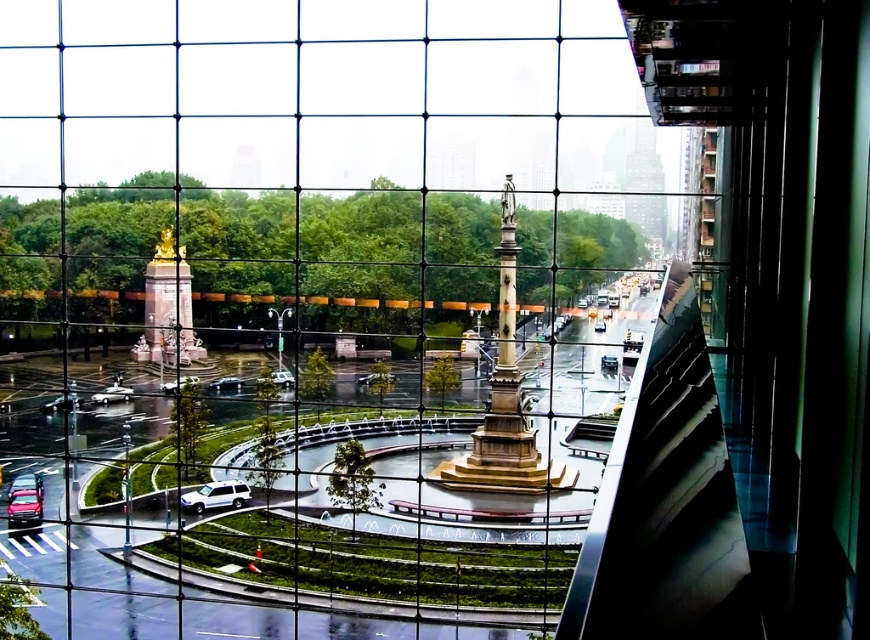
Question: Can you confirm if gold polished statue at center-left is positioned to the left of shiny silver sedan at center?

Choices:
 (A) yes
 (B) no

Answer: (A)

Question: Estimate the real-world distances between objects in this image. Which object is closer to the shiny silver car at lower left?

Choices:
 (A) silver metallic car at center
 (B) shiny silver car at center
 (C) silver metallic sedan at center

Answer: (C)

Question: Is shiny silver car at center wider than metallic silver suv at center?

Choices:
 (A) yes
 (B) no

Answer: (A)

Question: Estimate the real-world distances between objects in this image. Which object is farther from the shiny silver car at lower left?

Choices:
 (A) shiny silver suv at center
 (B) metallic silver suv at center
 (C) shiny silver car at center

Answer: (B)

Question: Which point appears closest to the camera in this image?

Choices:
 (A) (39, 483)
 (B) (199, 500)
 (C) (387, 378)
 (D) (185, 381)

Answer: (B)

Question: Is shiny silver sedan at center to the left of metallic silver suv at center from the viewer's perspective?

Choices:
 (A) yes
 (B) no

Answer: (A)